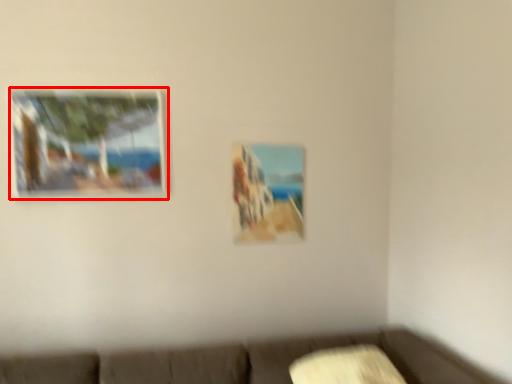
Question: Where is picture frame (annotated by the red box) located in relation to picture frame in the image?

Choices:
 (A) right
 (B) left

Answer: (B)